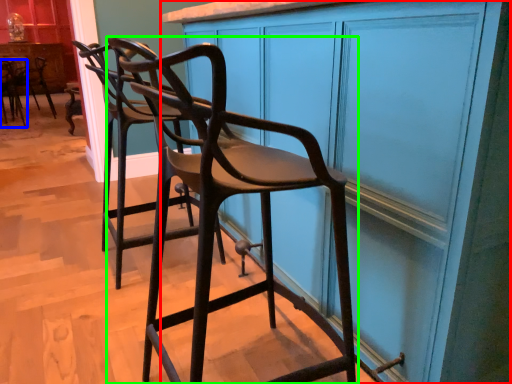
Question: Which object is the farthest from cabinetry (highlighted by a red box)? Choose among these: chair (highlighted by a blue box) or chair (highlighted by a green box).

Choices:
 (A) chair
 (B) chair

Answer: (A)